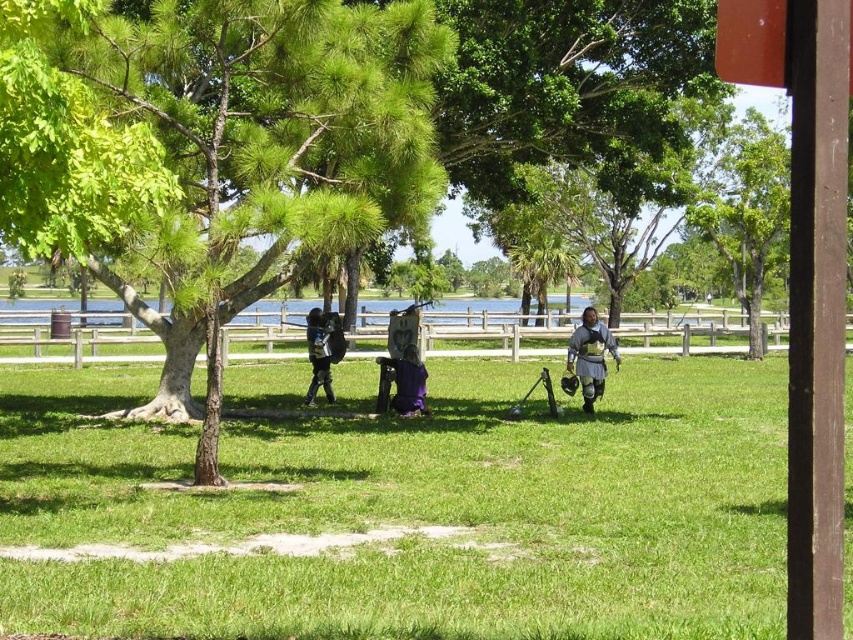
Question: Is shiny black armor at center smaller than purple velvet bag at center?

Choices:
 (A) no
 (B) yes

Answer: (A)

Question: Among these objects, which one is farthest from the camera?

Choices:
 (A) green grassy field at center
 (B) purple velvet bag at center
 (C) shiny silver armor at center
 (D) green leafy tree at center

Answer: (B)

Question: Which object is the closest to the green leafy tree at center?

Choices:
 (A) shiny black armor at center
 (B) shiny silver armor at center

Answer: (A)

Question: Is green grassy field at center above purple velvet bag at center?

Choices:
 (A) yes
 (B) no

Answer: (B)

Question: Is green leafy tree at center to the left of purple velvet bag at center from the viewer's perspective?

Choices:
 (A) no
 (B) yes

Answer: (B)

Question: Which point is closer to the camera?

Choices:
 (A) (125, 616)
 (B) (412, 362)
 (C) (216, 240)

Answer: (A)